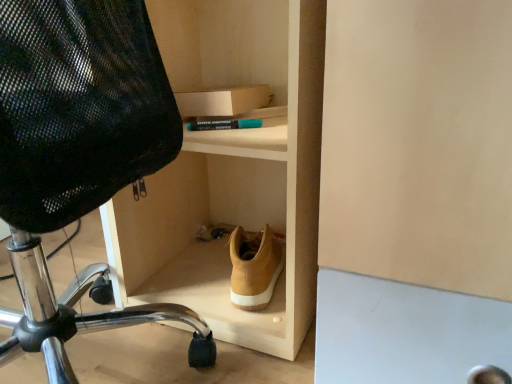
Question: Would you consider black mesh chair at left to be distant from light wood shoe at lower center?

Choices:
 (A) no
 (B) yes

Answer: (A)

Question: Can you confirm if black mesh chair at left is bigger than light wood shoe at lower center?

Choices:
 (A) no
 (B) yes

Answer: (B)

Question: From the image's perspective, does black mesh chair at left appear higher than light wood shoe at lower center?

Choices:
 (A) yes
 (B) no

Answer: (B)

Question: From a real-world perspective, is black mesh chair at left positioned under light wood shoe at lower center based on gravity?

Choices:
 (A) yes
 (B) no

Answer: (A)

Question: Is black mesh chair at left surrounding light wood shoe at lower center?

Choices:
 (A) yes
 (B) no

Answer: (B)

Question: Is point (254, 253) positioned closer to the camera than point (55, 329)?

Choices:
 (A) farther
 (B) closer

Answer: (A)

Question: From the image's perspective, relative to black mesh chair at left, is tan suede shoe at center above or below?

Choices:
 (A) above
 (B) below

Answer: (B)

Question: Would you say tan suede shoe at center is inside or outside black mesh chair at left?

Choices:
 (A) outside
 (B) inside

Answer: (A)

Question: In the image, is tan suede shoe at center positioned in front of or behind black mesh chair at left?

Choices:
 (A) front
 (B) behind

Answer: (B)

Question: Considering their positions, is light wood shoe at lower center located in front of or behind black mesh chair at left?

Choices:
 (A) front
 (B) behind

Answer: (B)

Question: From the image's perspective, relative to black mesh chair at left, is light wood shoe at lower center above or below?

Choices:
 (A) below
 (B) above

Answer: (B)

Question: In terms of size, does light wood shoe at lower center appear bigger or smaller than black mesh chair at left?

Choices:
 (A) big
 (B) small

Answer: (B)

Question: Looking at their shapes, would you say light wood shoe at lower center is wider or thinner than black mesh chair at left?

Choices:
 (A) wide
 (B) thin

Answer: (B)

Question: Is point (256, 306) closer or farther from the camera than point (163, 3)?

Choices:
 (A) farther
 (B) closer

Answer: (B)

Question: From the image's perspective, is tan suede shoe at center above or below light wood shoe at lower center?

Choices:
 (A) above
 (B) below

Answer: (B)